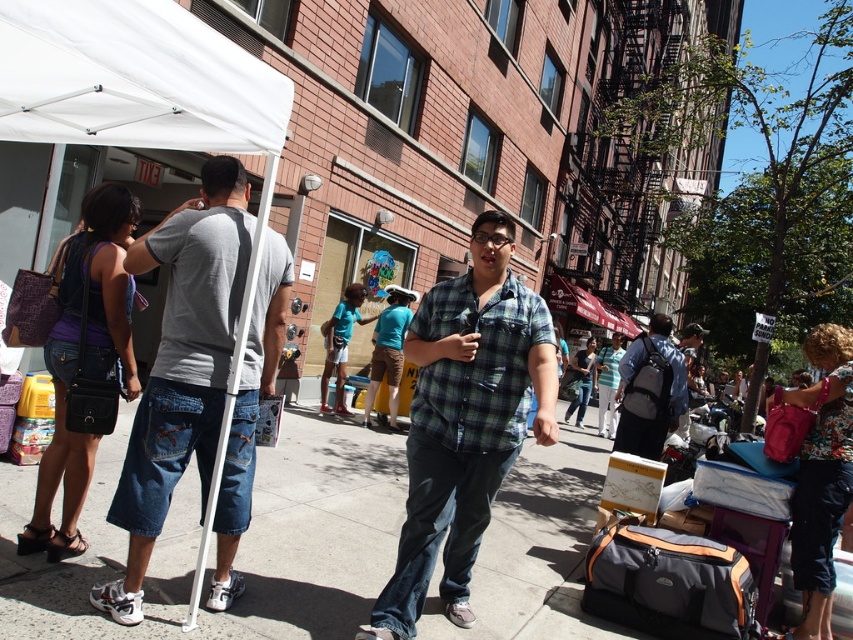
Question: Among these objects, which one is nearest to the camera?

Choices:
 (A) denim shorts at left
 (B) matte gray backpack at center

Answer: (A)

Question: Estimate the real-world distances between objects in this image. Which object is closer to the matte gray backpack at center?

Choices:
 (A) green plaid shirt at center
 (B) denim shorts at left

Answer: (A)

Question: Observing the image, what is the correct spatial positioning of denim shorts at left in reference to white fabric canopy at upper left?

Choices:
 (A) left
 (B) right

Answer: (B)

Question: Does denim shorts at left lie in front of white fabric canopy at upper left?

Choices:
 (A) no
 (B) yes

Answer: (A)

Question: Is white fabric canopy at upper left wider than matte gray backpack at center?

Choices:
 (A) no
 (B) yes

Answer: (B)

Question: Based on their relative distances, which object is farther from the green plaid shirt at center?

Choices:
 (A) white fabric canopy at upper left
 (B) matte gray backpack at center
 (C) denim shorts at left

Answer: (B)